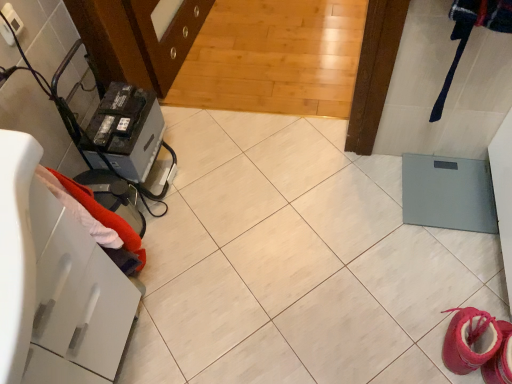
Question: Considering the relative positions of black plastic battery at left and white glossy drawer at left in the image provided, is black plastic battery at left to the left of white glossy drawer at left from the viewer's perspective?

Choices:
 (A) yes
 (B) no

Answer: (B)

Question: Is black plastic battery at left touching white glossy drawer at left?

Choices:
 (A) yes
 (B) no

Answer: (B)

Question: Can you confirm if black plastic battery at left is smaller than white glossy drawer at left?

Choices:
 (A) no
 (B) yes

Answer: (B)

Question: From the image's perspective, is black plastic battery at left beneath white glossy drawer at left?

Choices:
 (A) yes
 (B) no

Answer: (B)

Question: Is white glossy drawer at left at the back of black plastic battery at left?

Choices:
 (A) no
 (B) yes

Answer: (A)

Question: Would you say black plastic battery at left is a long distance from white glossy drawer at left?

Choices:
 (A) yes
 (B) no

Answer: (B)

Question: Is red fabric towel at left positioned beyond the bounds of black plastic battery at left?

Choices:
 (A) no
 (B) yes

Answer: (B)

Question: From a real-world perspective, is red fabric towel at left physically below black plastic battery at left?

Choices:
 (A) no
 (B) yes

Answer: (A)

Question: Is red fabric towel at left wider than black plastic battery at left?

Choices:
 (A) no
 (B) yes

Answer: (A)

Question: Is red fabric towel at left turned away from black plastic battery at left?

Choices:
 (A) no
 (B) yes

Answer: (A)

Question: Can you confirm if red fabric towel at left is thinner than black plastic battery at left?

Choices:
 (A) yes
 (B) no

Answer: (A)

Question: Is black plastic battery at left inside red fabric towel at left?

Choices:
 (A) no
 (B) yes

Answer: (A)

Question: Considering the relative positions of white glossy drawer at left and black plastic battery at left in the image provided, is white glossy drawer at left to the right of black plastic battery at left from the viewer's perspective?

Choices:
 (A) yes
 (B) no

Answer: (B)